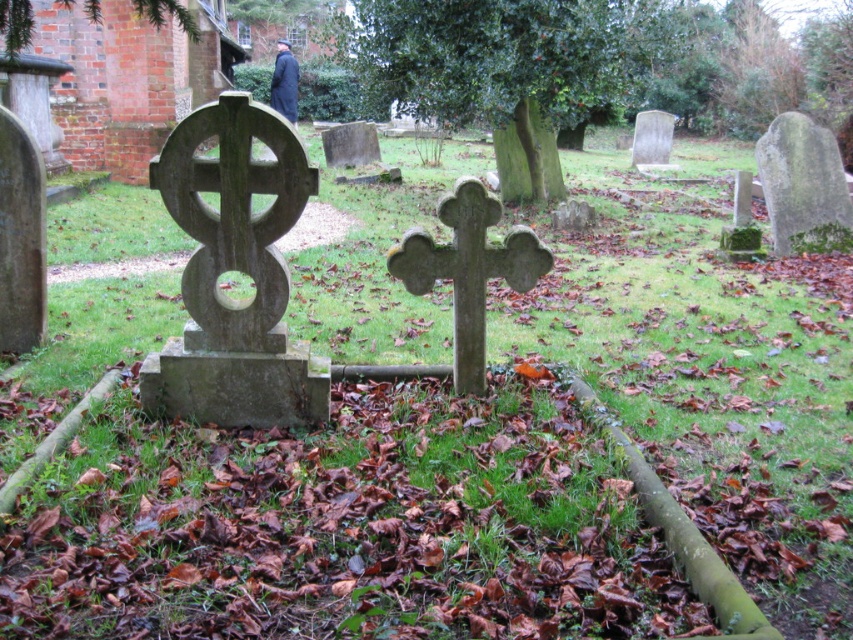
You are standing at the entrance of the cemetery and see the dark gray stone cross at center. If you walk straight towards it, will you reach it before the brick building in the background?

The dark gray stone cross at center is located at point (x=468, y=269), which is closer to the entrance than the brick building in the background. Therefore, you will reach the dark gray stone cross at center before the brick building.

You are a visitor at the cemetery and want to take a photo of both the dark gray stone cross at center and the smooth gray stone cross at center. Which one should you stand closer to in order to capture both in the frame without moving the camera?

You should stand closer to the smooth gray stone cross at center because it is shorter than the dark gray stone cross at center, allowing both to fit within the camera frame when positioned appropriately.